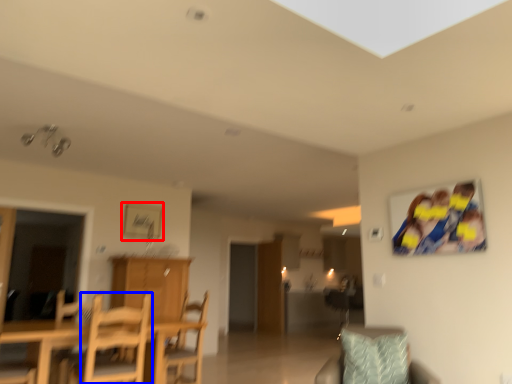
Question: Which object appears farthest to the camera in this image, picture frame (highlighted by a red box) or chair (highlighted by a blue box)?

Choices:
 (A) picture frame
 (B) chair

Answer: (A)